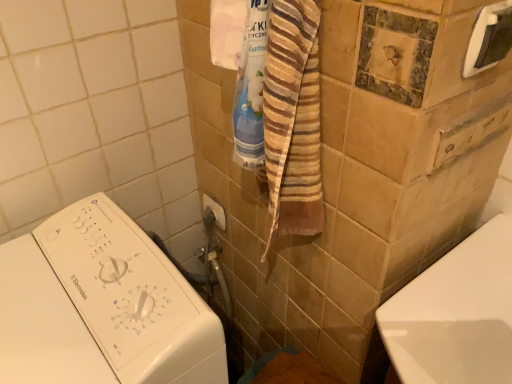
Question: Is metallic silver towel bar at upper center, which appears as the first towel bar when ordered from the bottom, facing towards white plastic washing machine at left?

Choices:
 (A) no
 (B) yes

Answer: (B)

Question: Are metallic silver towel bar at upper center, placed as the 2th towel bar when sorted from right to left, and white plastic washing machine at left beside each other?

Choices:
 (A) no
 (B) yes

Answer: (A)

Question: Can you confirm if metallic silver towel bar at upper center, the first towel bar in the back-to-front sequence, is thinner than white plastic washing machine at left?

Choices:
 (A) yes
 (B) no

Answer: (A)

Question: Can you confirm if metallic silver towel bar at upper center, placed as the 2th towel bar when sorted from right to left, is wider than white plastic washing machine at left?

Choices:
 (A) no
 (B) yes

Answer: (A)

Question: From a real-world perspective, is metallic silver towel bar at upper center, which appears as the first towel bar when ordered from the bottom, located beneath white plastic washing machine at left?

Choices:
 (A) yes
 (B) no

Answer: (B)

Question: From the image's perspective, relative to white plastic towel bar at upper right, acting as the first towel bar starting from the front, is white plastic washing machine at left above or below?

Choices:
 (A) below
 (B) above

Answer: (A)

Question: Is white plastic washing machine at left wider or thinner than white plastic towel bar at upper right, acting as the first towel bar starting from the front?

Choices:
 (A) thin
 (B) wide

Answer: (B)

Question: Is point (25, 377) positioned closer to the camera than point (501, 56)?

Choices:
 (A) closer
 (B) farther

Answer: (B)

Question: Is white plastic washing machine at left spatially inside white plastic towel bar at upper right, acting as the first towel bar starting from the front, or outside of it?

Choices:
 (A) inside
 (B) outside

Answer: (B)

Question: From the image's perspective, is white plastic washing machine at left located above or below metallic silver towel bar at upper center, the first towel bar in the back-to-front sequence?

Choices:
 (A) below
 (B) above

Answer: (A)

Question: Is white plastic washing machine at left bigger or smaller than metallic silver towel bar at upper center, the first towel bar in the back-to-front sequence?

Choices:
 (A) big
 (B) small

Answer: (A)

Question: Is white plastic washing machine at left taller or shorter than metallic silver towel bar at upper center, which appears as the first towel bar when ordered from the bottom?

Choices:
 (A) tall
 (B) short

Answer: (A)

Question: Would you say white plastic washing machine at left is to the left or to the right of metallic silver towel bar at upper center, the first towel bar in the back-to-front sequence, in the picture?

Choices:
 (A) left
 (B) right

Answer: (A)

Question: Based on their sizes in the image, would you say metallic silver towel bar at upper center, positioned as the 2th towel bar in top-to-bottom order, is bigger or smaller than white plastic towel bar at upper right, the 2th towel bar positioned from the back?

Choices:
 (A) small
 (B) big

Answer: (A)

Question: Is metallic silver towel bar at upper center, the first towel bar in the back-to-front sequence, inside the boundaries of white plastic towel bar at upper right, which ranks as the second towel bar in bottom-to-top order, or outside?

Choices:
 (A) inside
 (B) outside

Answer: (B)